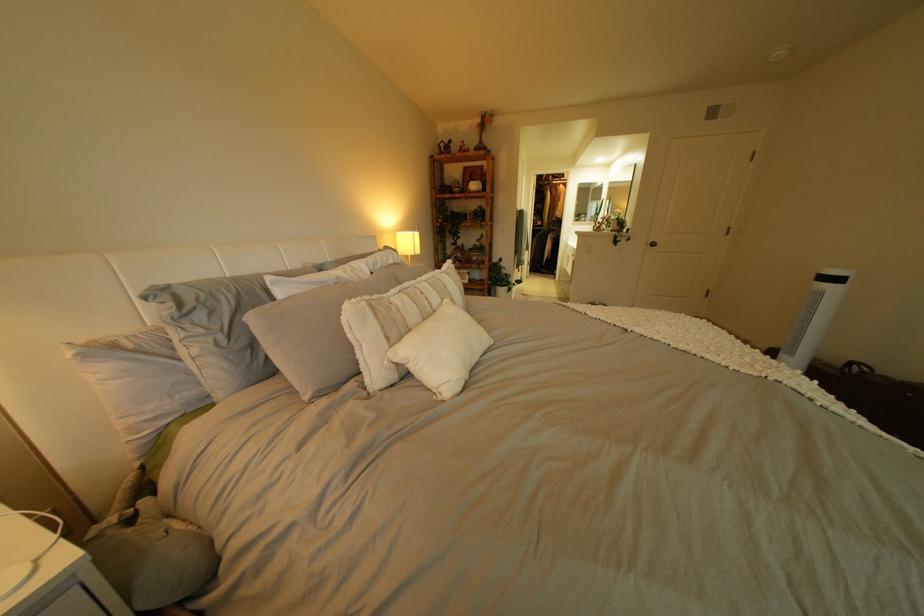
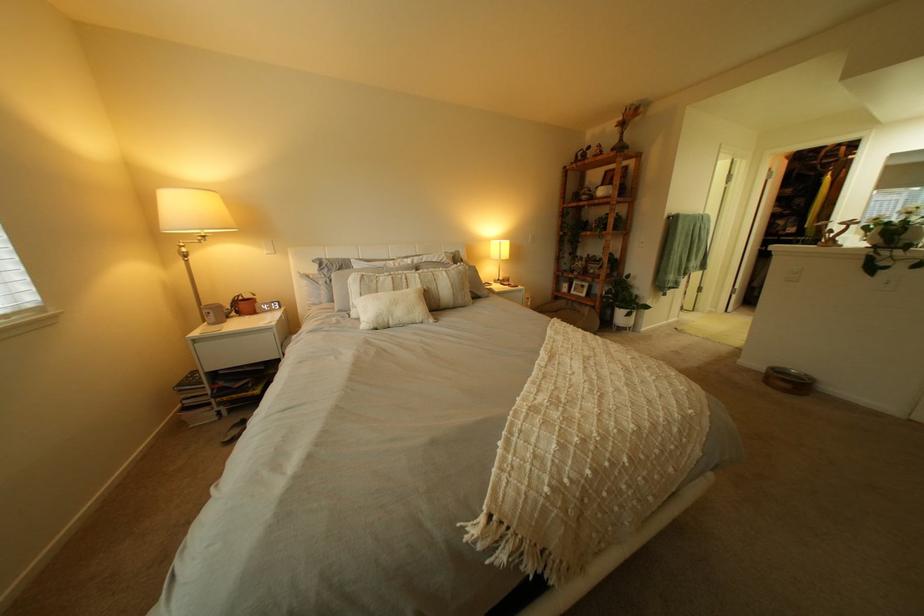
In the second image, find the point that corresponds to (515,284) in the first image.

(633, 305)